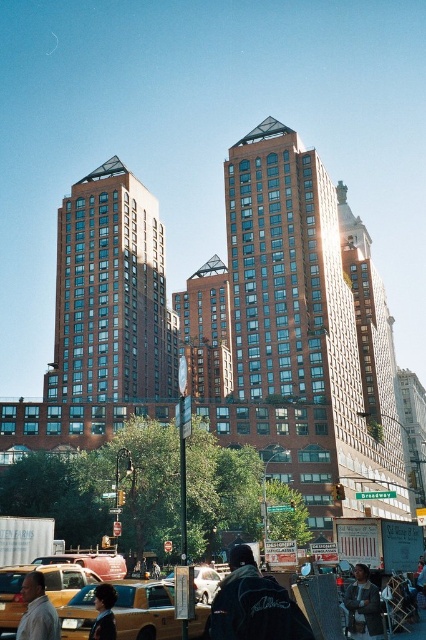
You are a delivery drone flying over the city and need to land on the rooftop of the building where the yellow matte taxi at lower left is parked. According to the coordinates provided, where should you aim to land?

The yellow matte taxi at lower left is located at coordinates point (45,586). To land on the rooftop of the building where it is parked, aim for the area corresponding to those coordinates, which would be near the lower left section of the building.

You are a pedestrian standing at the intersection near the yellow matte taxi at lower left and the shiny black hair at center. Which object is closer to you?

The yellow matte taxi at lower left is closer to you because it is further to the viewer than the shiny black hair at center, meaning it appears nearer in the scene.